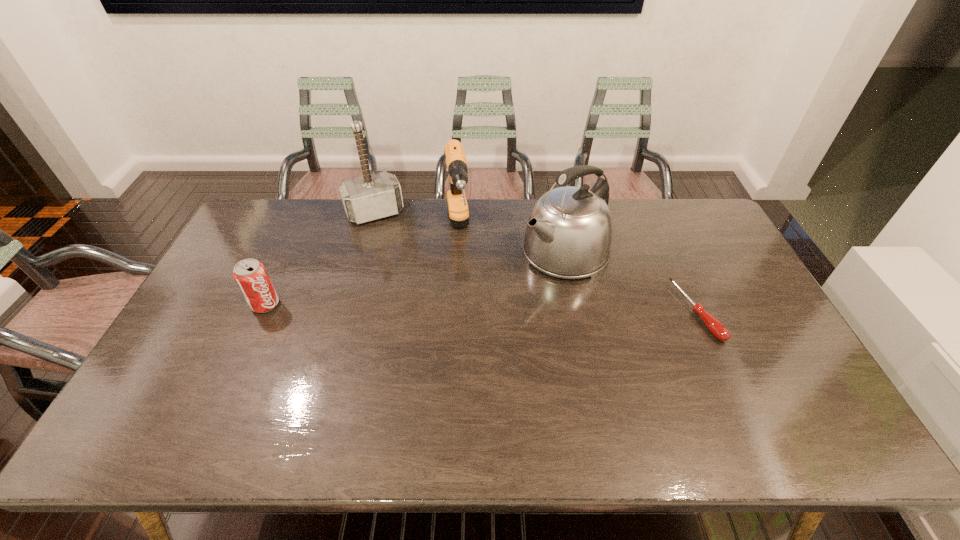
You are a GUI agent. You are given a task and a screenshot of the screen. Output one action in this format:
    pyautogui.click(x=<x>, y=<y>)
    Task: Click on the kettle that is at the far edge
    The width and height of the screenshot is (960, 540).
    Given the screenshot: What is the action you would take?
    pyautogui.click(x=568, y=235)

I want to click on hammer located at the far edge, so click(371, 197).

Locate an element on the screen. object situated at the left edge is located at coordinates (251, 276).

Locate an element on the screen. This screenshot has width=960, height=540. object situated at the right edge is located at coordinates (714, 326).

The width and height of the screenshot is (960, 540). In the image, there is a desktop. Find the location of `vacant space at the far edge`. vacant space at the far edge is located at coordinates (326, 220).

This screenshot has height=540, width=960. Identify the location of vacant space at the near edge of the desktop. point(408,379).

Locate an element on the screen. vacant space at the left edge is located at coordinates point(208,362).

You are a GUI agent. You are given a task and a screenshot of the screen. Output one action in this format:
    pyautogui.click(x=<x>, y=<y>)
    Task: Click on the free region at the right edge of the desktop
    Image resolution: width=960 pixels, height=540 pixels.
    Given the screenshot: What is the action you would take?
    pyautogui.click(x=731, y=264)

This screenshot has width=960, height=540. What are the coordinates of `blank space at the far left corner` in the screenshot? It's located at (283, 205).

This screenshot has width=960, height=540. In order to click on vacant space at the far right corner in this screenshot , I will do `click(706, 208)`.